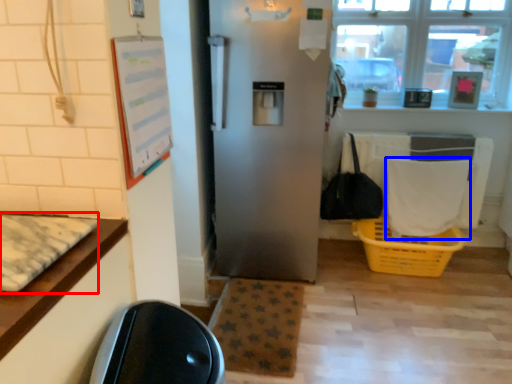
Question: Which point is closer to the camera, mat (highlighted by a red box) or laundry (highlighted by a blue box)?

Choices:
 (A) mat
 (B) laundry

Answer: (A)